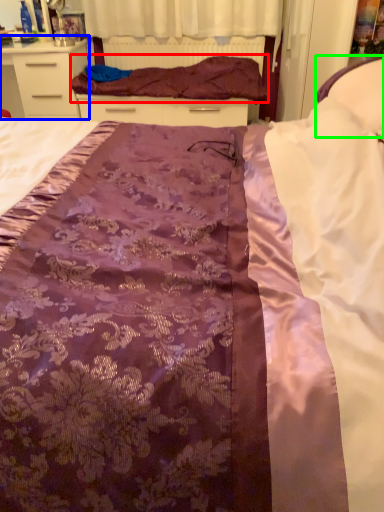
Question: Which object is positioned closest to blanket (highlighted by a red box)? Select from chest of drawers (highlighted by a blue box) and pillow (highlighted by a green box).

Choices:
 (A) chest of drawers
 (B) pillow

Answer: (A)